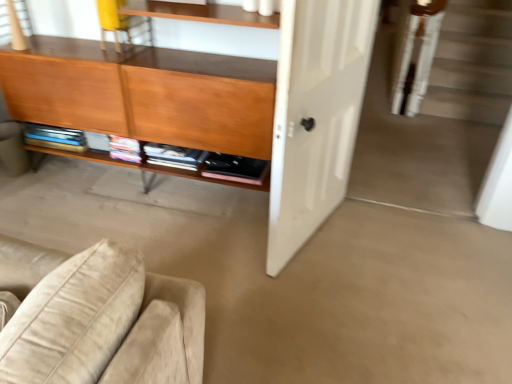
Question: Considering the relative positions of clear glass window at upper left and yellow fabric chair at upper left in the image provided, is clear glass window at upper left to the left of yellow fabric chair at upper left from the viewer's perspective?

Choices:
 (A) yes
 (B) no

Answer: (A)

Question: Would you say clear glass window at upper left contains yellow fabric chair at upper left?

Choices:
 (A) yes
 (B) no

Answer: (B)

Question: Does clear glass window at upper left have a larger size compared to yellow fabric chair at upper left?

Choices:
 (A) no
 (B) yes

Answer: (B)

Question: Considering the relative positions of clear glass window at upper left and yellow fabric chair at upper left in the image provided, is clear glass window at upper left in front of yellow fabric chair at upper left?

Choices:
 (A) yes
 (B) no

Answer: (A)

Question: Is clear glass window at upper left to the right of yellow fabric chair at upper left from the viewer's perspective?

Choices:
 (A) no
 (B) yes

Answer: (A)

Question: Is clear glass window at upper left not near yellow fabric chair at upper left?

Choices:
 (A) yes
 (B) no

Answer: (B)

Question: Does white matte door at center touch matte wood cabinet at left?

Choices:
 (A) yes
 (B) no

Answer: (B)

Question: Does white matte door at center have a lesser width compared to matte wood cabinet at left?

Choices:
 (A) yes
 (B) no

Answer: (A)

Question: Is white matte door at center smaller than matte wood cabinet at left?

Choices:
 (A) no
 (B) yes

Answer: (B)

Question: Can you confirm if white matte door at center is shorter than matte wood cabinet at left?

Choices:
 (A) yes
 (B) no

Answer: (B)

Question: Does white matte door at center have a larger size compared to matte wood cabinet at left?

Choices:
 (A) yes
 (B) no

Answer: (B)

Question: Does white matte door at center contain matte wood cabinet at left?

Choices:
 (A) yes
 (B) no

Answer: (B)

Question: From the image's perspective, is matte wood cabinet at left beneath white matte door at center?

Choices:
 (A) no
 (B) yes

Answer: (A)